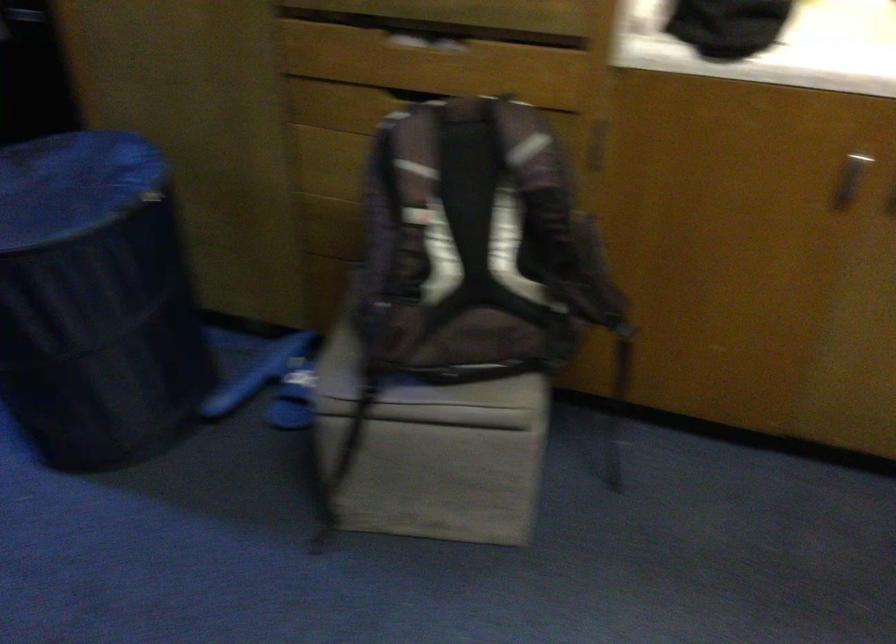
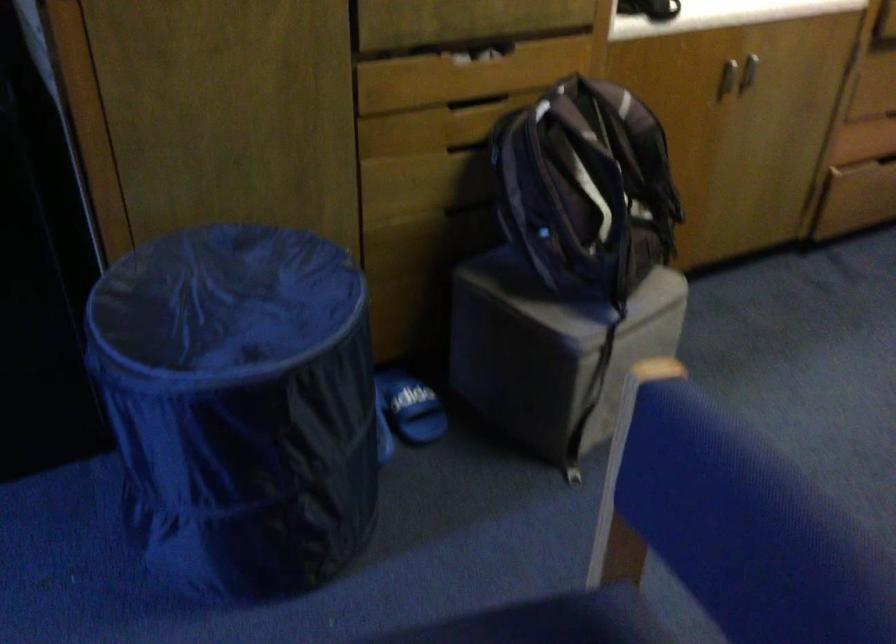
In the second image, find the point that corresponds to point 449,102 in the first image.

(476, 102)